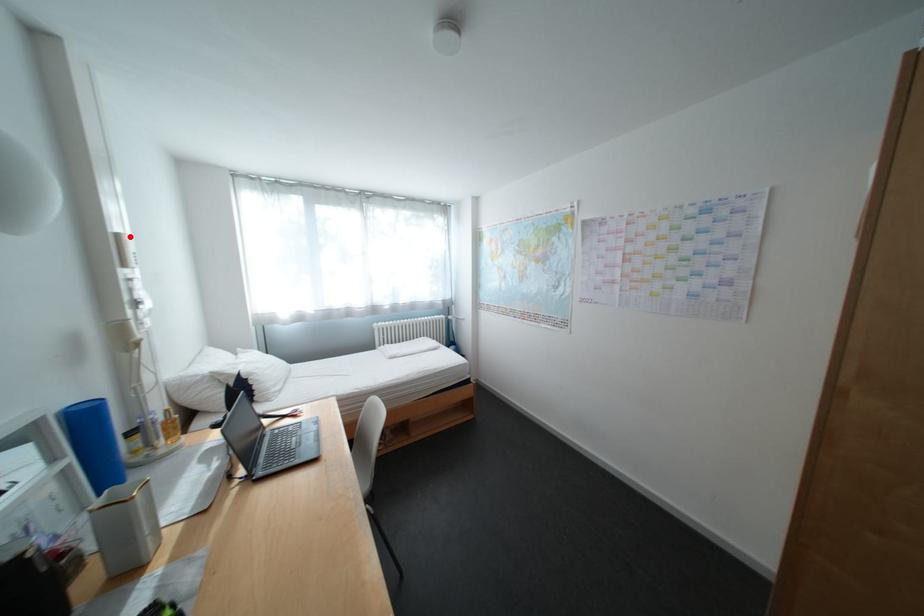
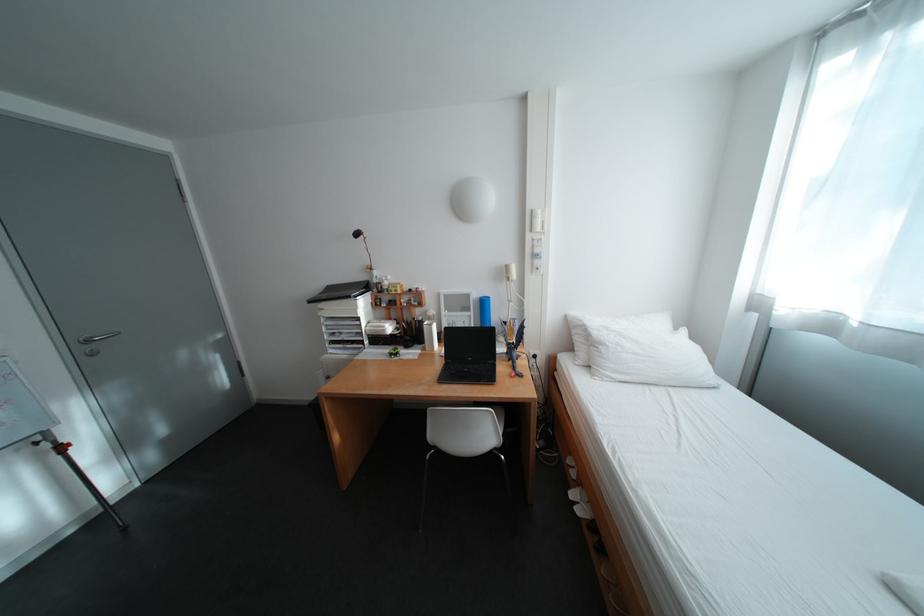
Question: I am providing you with two images of the same scene from different viewpoints. In image1, a red point is highlighted. Considering the same 3D point in image2, which of the following is correct?

Choices:
 (A) It is closer
 (B) It is farther

Answer: (A)